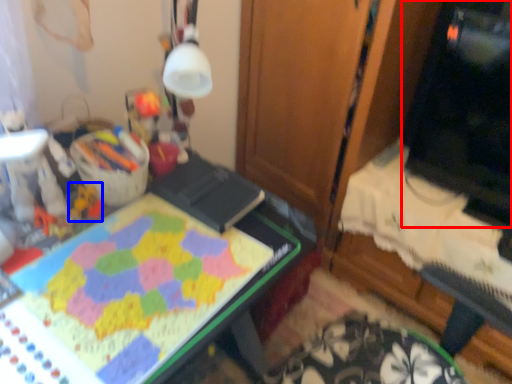
Question: Which of the following is the farthest to the observer, computer monitor (highlighted by a red box) or toy (highlighted by a blue box)?

Choices:
 (A) computer monitor
 (B) toy

Answer: (A)